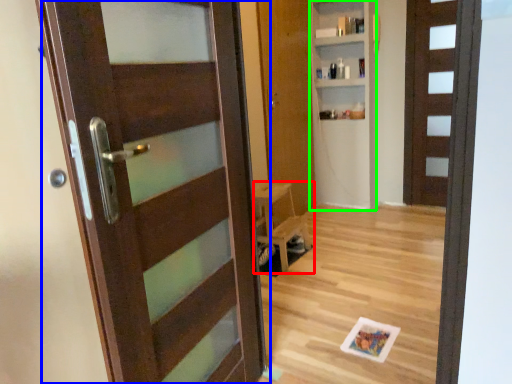
Question: Which object is positioned farthest from furniture (highlighted by a red box)? Select from door (highlighted by a blue box) and bookshelf (highlighted by a green box).

Choices:
 (A) door
 (B) bookshelf

Answer: (A)